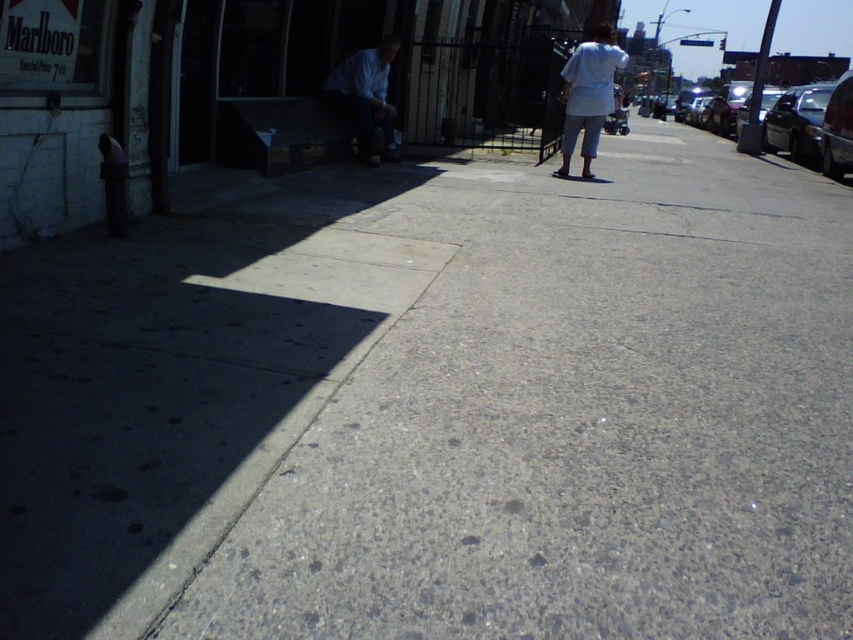
Is white cotton pants at center positioned at the back of metallic silver van at right?

No.

Does point (596, 104) come farther from viewer compared to point (822, 147)?

No, (596, 104) is closer to viewer.

Find the location of `white cotton pants at center`. white cotton pants at center is located at coordinates (589, 96).

Who is positioned more to the left, white cotton pants at center or shiny black sedan at right?

Positioned to the left is white cotton pants at center.

Is white cotton pants at center thinner than shiny black sedan at right?

Correct, white cotton pants at center's width is less than shiny black sedan at right's.

Describe the element at coordinates (589, 96) in the screenshot. I see `white cotton pants at center` at that location.

Find the location of a particular element. This screenshot has width=853, height=640. white cotton pants at center is located at coordinates (589, 96).

Does point (776, 136) lie in front of point (849, 138)?

No, (776, 136) is behind (849, 138).

Between shiny black sedan at right and metallic silver van at right, which one is positioned higher?

shiny black sedan at right

The height and width of the screenshot is (640, 853). Find the location of `shiny black sedan at right`. shiny black sedan at right is located at coordinates (798, 122).